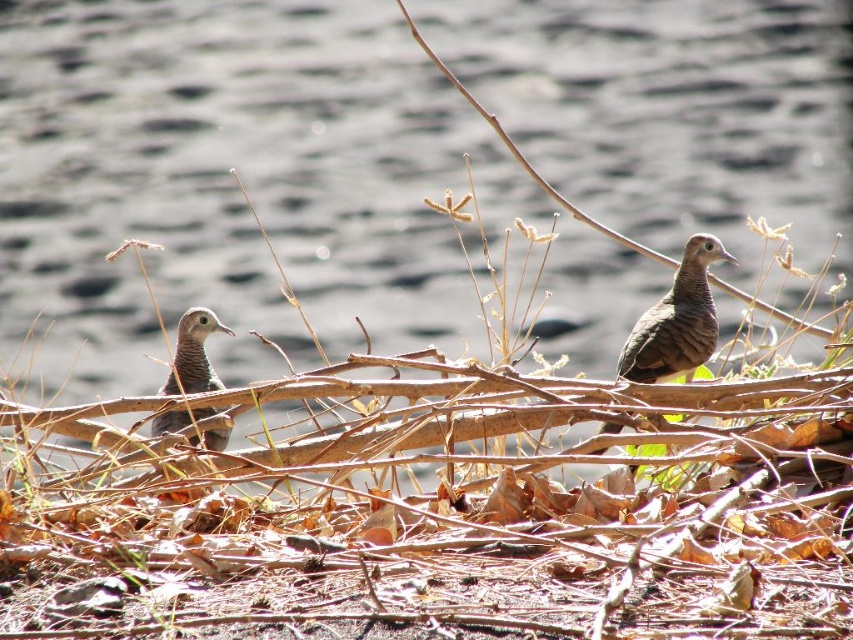
Question: Among these objects, which one is farthest from the camera?

Choices:
 (A) brown speckled feathers at left
 (B) brown speckled feathers at center

Answer: (B)

Question: Does brown speckled feathers at center come in front of brown speckled feathers at left?

Choices:
 (A) no
 (B) yes

Answer: (A)

Question: Among these objects, which one is farthest from the camera?

Choices:
 (A) brown speckled feathers at center
 (B) brown speckled feathers at left

Answer: (A)

Question: Does brown speckled feathers at center appear over brown speckled feathers at left?

Choices:
 (A) no
 (B) yes

Answer: (B)

Question: Which object is farther from the camera taking this photo?

Choices:
 (A) brown speckled feathers at left
 (B) brown speckled feathers at center

Answer: (B)

Question: Is brown speckled feathers at center closer to camera compared to brown speckled feathers at left?

Choices:
 (A) yes
 (B) no

Answer: (B)